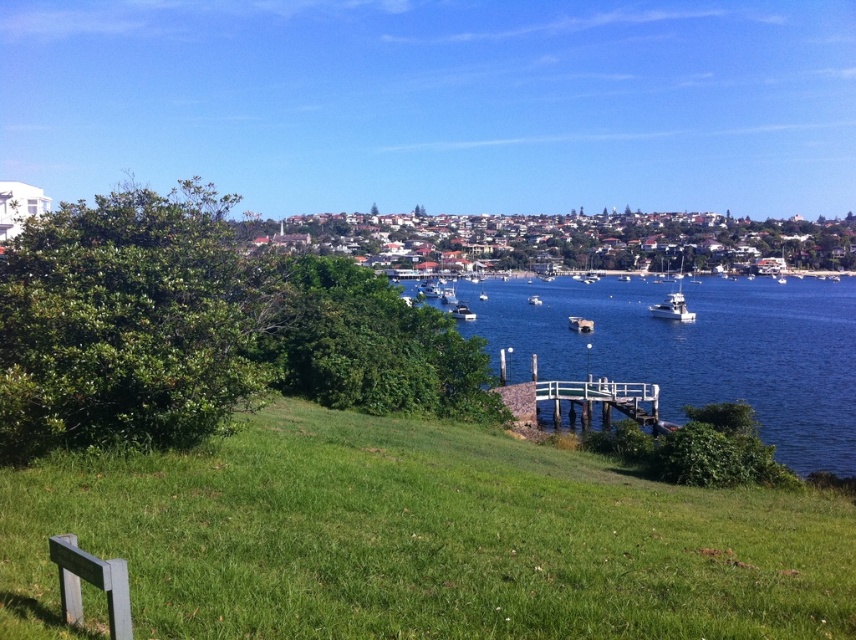
Is white glossy boat at right closer to camera compared to white glossy boat at center?

Yes.

Is point (678, 320) more distant than point (465, 314)?

No, (678, 320) is in front of (465, 314).

Does point (679, 301) come behind point (468, 321)?

No.

Identify the location of white glossy boat at right. This screenshot has height=640, width=856. (672, 307).

The image size is (856, 640). Describe the element at coordinates (419, 540) in the screenshot. I see `green grassy at lower center` at that location.

Is green grassy at lower center closer to camera compared to white glossy boat at center?

That is True.

Is point (639, 621) more distant than point (462, 310)?

No, (639, 621) is closer to viewer.

I want to click on green grassy at lower center, so click(x=419, y=540).

Looking at this image, who is taller, blue wooden dock at lower center or white glossy boat at right?

blue wooden dock at lower center is taller.

Is point (681, 362) closer to viewer compared to point (678, 280)?

Yes, it is in front of point (678, 280).

The height and width of the screenshot is (640, 856). I want to click on blue wooden dock at lower center, so click(x=694, y=349).

Image resolution: width=856 pixels, height=640 pixels. What are the coordinates of `blue wooden dock at lower center` in the screenshot? It's located at (694, 349).